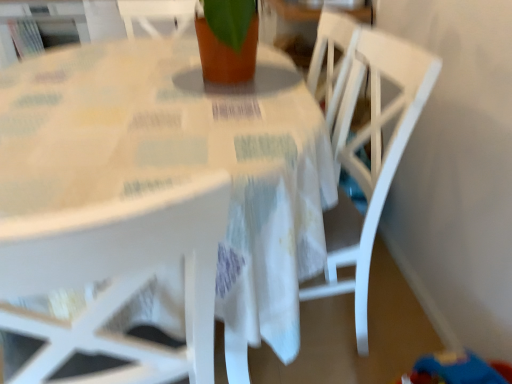
Identify the location of white wood chair at center. (371, 159).

What do you see at coordinates (371, 159) in the screenshot?
I see `white wood chair at center` at bounding box center [371, 159].

The width and height of the screenshot is (512, 384). In order to click on white fabric table at center in this screenshot , I will do (x=180, y=159).

The image size is (512, 384). What do you see at coordinates (180, 159) in the screenshot?
I see `white fabric table at center` at bounding box center [180, 159].

At what (x,y) coordinates should I click in order to perform the action: click on white wood chair at center. Please return your answer as a coordinate pair (x, y). The image size is (512, 384). Looking at the image, I should click on (371, 159).

Which object is positioned more to the left, white fabric table at center or white wood chair at center?

Positioned to the left is white fabric table at center.

Which object is further away from the camera, white fabric table at center or white wood chair at center?

white wood chair at center is more distant.

Is point (96, 153) in front of point (357, 159)?

Yes.

From the image's perspective, is white fabric table at center over white wood chair at center?

Yes, from the image's perspective, white fabric table at center is above white wood chair at center.

From a real-world perspective, which is physically below, white fabric table at center or white wood chair at center?

From a 3D spatial view, white fabric table at center is below.

Does white fabric table at center have a lesser width compared to white wood chair at center?

No.

Considering the sizes of white fabric table at center and white wood chair at center in the image, is white fabric table at center taller or shorter than white wood chair at center?

In the image, white fabric table at center appears to be shorter than white wood chair at center.

Considering the sizes of objects white fabric table at center and white wood chair at center in the image provided, who is bigger, white fabric table at center or white wood chair at center?

With larger size is white fabric table at center.

Which is correct: white fabric table at center is inside white wood chair at center, or outside of it?

white fabric table at center is located beyond the bounds of white wood chair at center.

Is white fabric table at center far away from white wood chair at center?

No, white fabric table at center is in close proximity to white wood chair at center.

Is white fabric table at center oriented away from white wood chair at center?

Yes.

Find the location of a particular element. This screenshot has width=512, height=384. chair behind the white fabric table at center is located at coordinates (371, 159).

In the image, is white wood chair at center on the left side or the right side of white fabric table at center?

From the image, it's evident that white wood chair at center is to the right of white fabric table at center.

Considering their positions, is white wood chair at center located in front of or behind white fabric table at center?

Clearly, white wood chair at center is behind white fabric table at center.

Considering the positions of point (333, 285) and point (95, 142), is point (333, 285) closer or farther from the camera than point (95, 142)?

Clearly, point (333, 285) is more distant from the camera than point (95, 142).

From the image's perspective, which is above, white wood chair at center or white fabric table at center?

→ white fabric table at center appears higher in the image.

From a real-world perspective, which is physically below, white wood chair at center or white fabric table at center?

From a 3D spatial view, white fabric table at center is below.

Considering the sizes of white wood chair at center and white fabric table at center in the image, is white wood chair at center wider or thinner than white fabric table at center?

In the image, white wood chair at center appears to be more narrow than white fabric table at center.

Which of these two, white wood chair at center or white fabric table at center, stands shorter?

white fabric table at center.

Who is bigger, white wood chair at center or white fabric table at center?

white fabric table at center is bigger.

Is white wood chair at center situated inside white fabric table at center or outside?

white wood chair at center can be found inside white fabric table at center.

Is the surface of white wood chair at center in direct contact with white fabric table at center?

No, white wood chair at center is not in contact with white fabric table at center.

Is white wood chair at center aimed at white fabric table at center?

Yes, white wood chair at center is aimed at white fabric table at center.

How much distance is there between white wood chair at center and white fabric table at center?

The distance of white wood chair at center from white fabric table at center is 13.63 inches.

In the image, there is a white wood chair at center. Find the location of `table above it (from the image's perspective)`. table above it (from the image's perspective) is located at coordinates (180, 159).

In order to click on table above the white wood chair at center (from the image's perspective) in this screenshot , I will do `click(180, 159)`.

In the image, there is a white wood chair at center. Where is `table below it (from a real-world perspective)`? table below it (from a real-world perspective) is located at coordinates (180, 159).